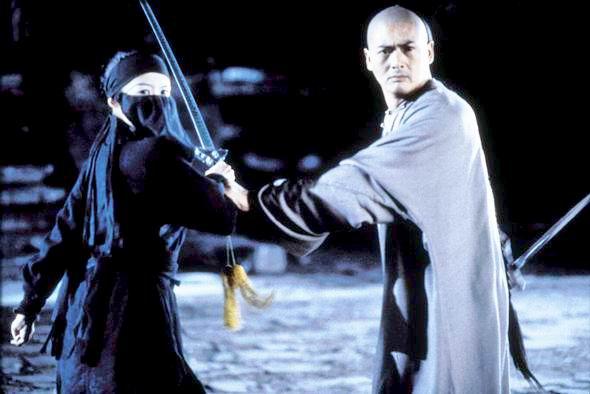
I want to click on tassels, so click(230, 303), click(245, 280).